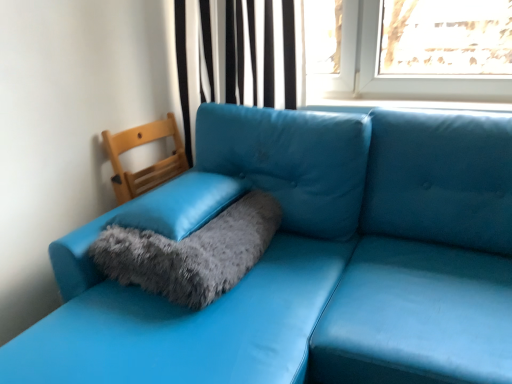
Question: Is fuzzy gray pillow at center in contact with matte blue leather couch at lower left?

Choices:
 (A) no
 (B) yes

Answer: (A)

Question: From the image's perspective, would you say fuzzy gray pillow at center is shown under matte blue leather couch at lower left?

Choices:
 (A) no
 (B) yes

Answer: (A)

Question: Is fuzzy gray pillow at center oriented away from matte blue leather couch at lower left?

Choices:
 (A) yes
 (B) no

Answer: (A)

Question: From a real-world perspective, is fuzzy gray pillow at center positioned under matte blue leather couch at lower left based on gravity?

Choices:
 (A) yes
 (B) no

Answer: (B)

Question: Could you tell me if fuzzy gray pillow at center is facing matte blue leather couch at lower left?

Choices:
 (A) no
 (B) yes

Answer: (B)

Question: From the image's perspective, is fuzzy gray pillow at center above matte blue leather couch at lower left?

Choices:
 (A) no
 (B) yes

Answer: (B)

Question: From a real-world perspective, is fuzzy gray cat bed at center over black striped curtain at upper center?

Choices:
 (A) no
 (B) yes

Answer: (A)

Question: Does fuzzy gray cat bed at center have a smaller size compared to black striped curtain at upper center?

Choices:
 (A) no
 (B) yes

Answer: (B)

Question: Does fuzzy gray cat bed at center touch black striped curtain at upper center?

Choices:
 (A) no
 (B) yes

Answer: (A)

Question: Considering the relative sizes of fuzzy gray cat bed at center and black striped curtain at upper center in the image provided, is fuzzy gray cat bed at center wider than black striped curtain at upper center?

Choices:
 (A) yes
 (B) no

Answer: (A)

Question: Is fuzzy gray cat bed at center positioned behind black striped curtain at upper center?

Choices:
 (A) no
 (B) yes

Answer: (A)

Question: Is fuzzy gray cat bed at center to the right of black striped curtain at upper center from the viewer's perspective?

Choices:
 (A) no
 (B) yes

Answer: (A)

Question: From a real-world perspective, is fuzzy gray cat bed at center positioned over matte blue leather couch at lower left based on gravity?

Choices:
 (A) no
 (B) yes

Answer: (B)